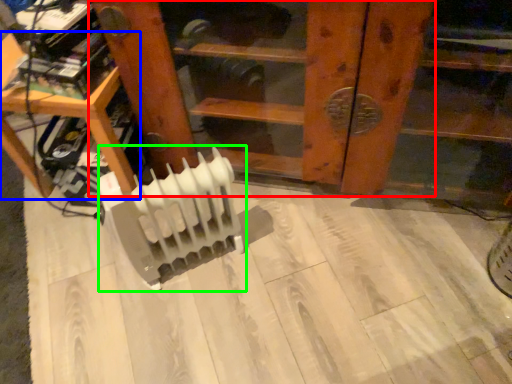
Question: Which object is positioned farthest from furniture (highlighted by a red box)? Select from furniture (highlighted by a blue box) and radiator (highlighted by a green box).

Choices:
 (A) furniture
 (B) radiator

Answer: (A)